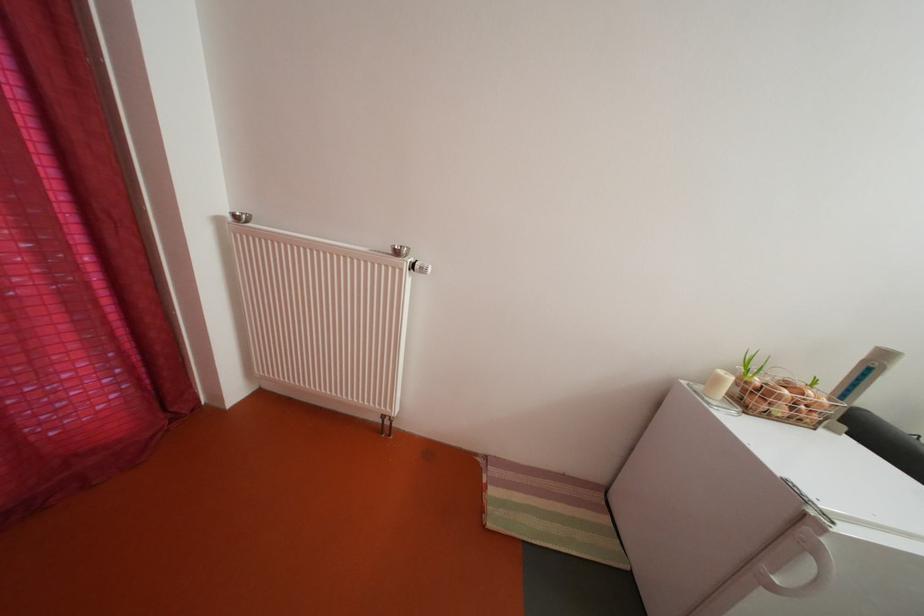
This screenshot has height=616, width=924. Find the location of `white candle`. white candle is located at coordinates (718, 384).